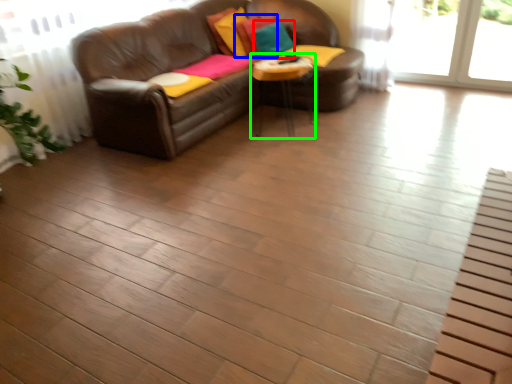
Question: Which is nearer to the pillow (highlighted by a red box)? pillow (highlighted by a blue box) or table (highlighted by a green box).

Choices:
 (A) pillow
 (B) table

Answer: (A)